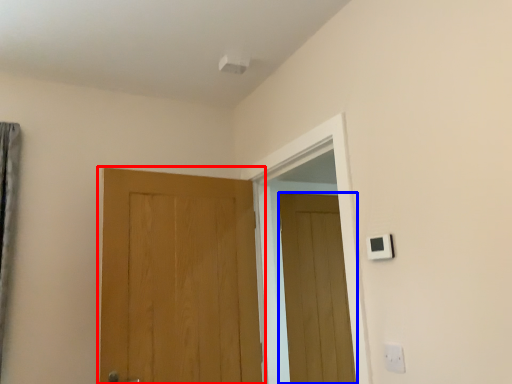
Question: Which object is further to the camera taking this photo, door (highlighted by a red box) or door (highlighted by a blue box)?

Choices:
 (A) door
 (B) door

Answer: (B)